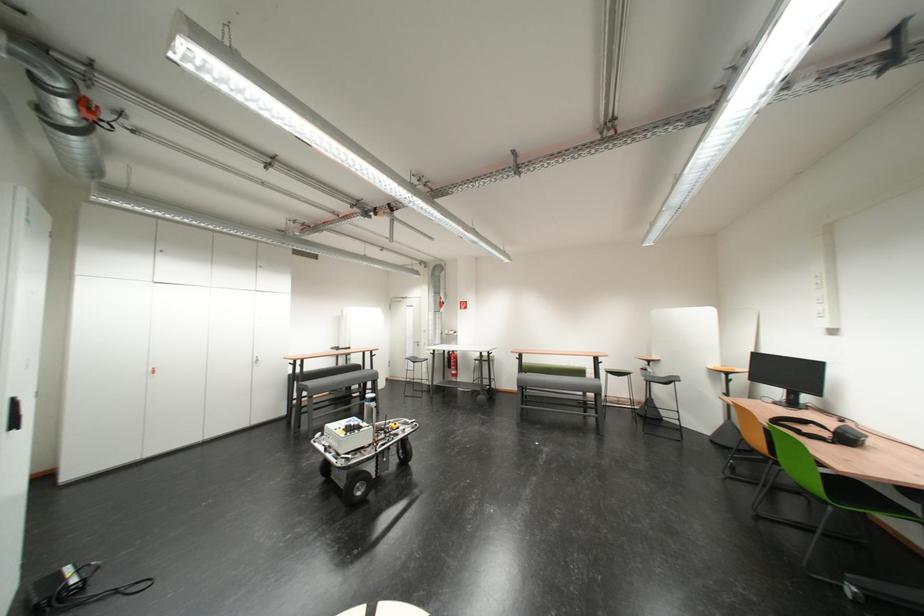
Find where to sit the grey chair sitting surface. Please return your answer as a coordinate pair (x, y).

(558, 383)